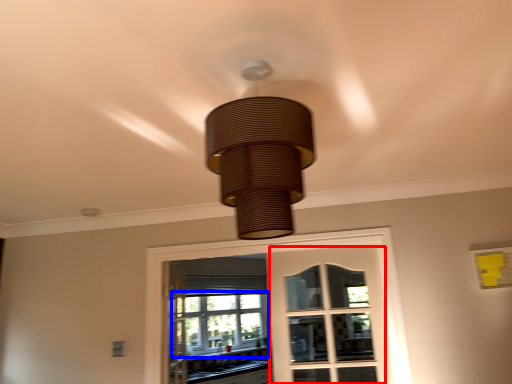
Question: Among these objects, which one is nearest to the camera, screen door (highlighted by a red box) or bay window (highlighted by a blue box)?

Choices:
 (A) screen door
 (B) bay window

Answer: (A)